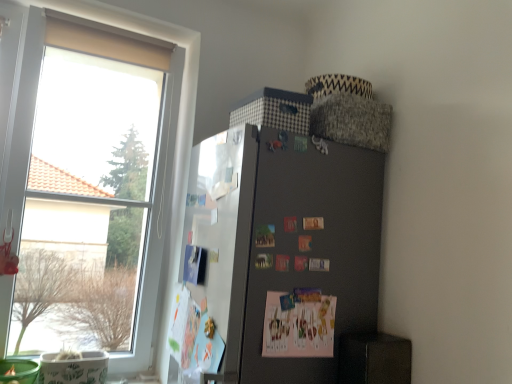
Question: Does pink paper postcard at center come in front of white paperboard at left?

Choices:
 (A) yes
 (B) no

Answer: (B)

Question: Considering the relative sizes of pink paper postcard at center and white paperboard at left in the image provided, is pink paper postcard at center thinner than white paperboard at left?

Choices:
 (A) yes
 (B) no

Answer: (A)

Question: From a real-world perspective, is pink paper postcard at center physically below white paperboard at left?

Choices:
 (A) no
 (B) yes

Answer: (B)

Question: Considering the relative positions of pink paper postcard at center and white paperboard at left in the image provided, is pink paper postcard at center to the left of white paperboard at left from the viewer's perspective?

Choices:
 (A) no
 (B) yes

Answer: (A)

Question: Considering the relative sizes of pink paper postcard at center and white paperboard at left in the image provided, is pink paper postcard at center wider than white paperboard at left?

Choices:
 (A) no
 (B) yes

Answer: (A)

Question: Is pink paper postcard at center oriented away from white paperboard at left?

Choices:
 (A) yes
 (B) no

Answer: (A)

Question: Can you confirm if white paperboard at left is shorter than satin black fridge at upper right?

Choices:
 (A) no
 (B) yes

Answer: (B)

Question: Is satin black fridge at upper right located within white paperboard at left?

Choices:
 (A) yes
 (B) no

Answer: (B)

Question: Considering the relative sizes of white paperboard at left and satin black fridge at upper right in the image provided, is white paperboard at left smaller than satin black fridge at upper right?

Choices:
 (A) yes
 (B) no

Answer: (A)

Question: From the image's perspective, would you say white paperboard at left is shown under satin black fridge at upper right?

Choices:
 (A) yes
 (B) no

Answer: (B)

Question: Does white paperboard at left have a larger size compared to satin black fridge at upper right?

Choices:
 (A) no
 (B) yes

Answer: (A)

Question: Is white paperboard at left outside satin black fridge at upper right?

Choices:
 (A) yes
 (B) no

Answer: (B)

Question: Does transparent glass window at left come behind satin black fridge at upper right?

Choices:
 (A) yes
 (B) no

Answer: (A)